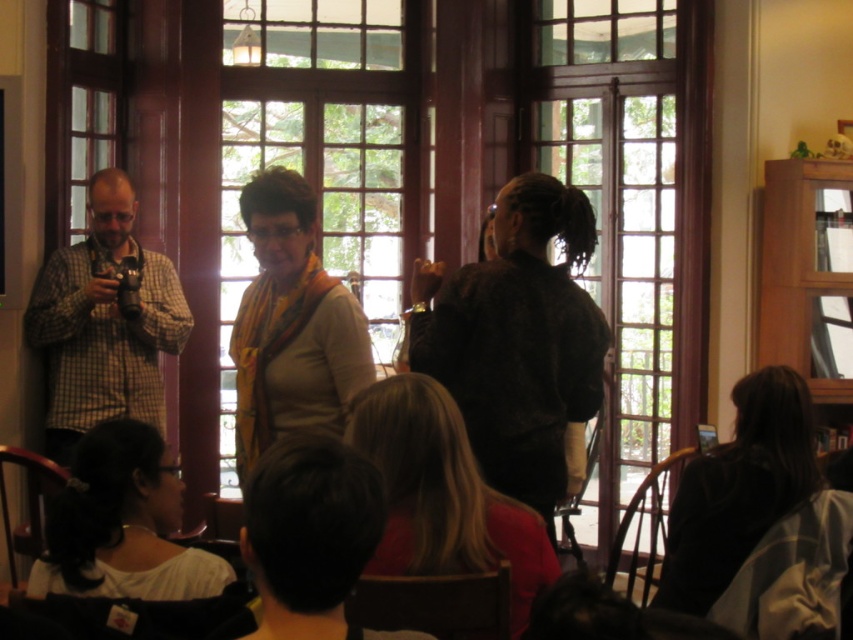
Question: Does matte yellow scarf at center have a greater width compared to white fabric at lower left?

Choices:
 (A) yes
 (B) no

Answer: (A)

Question: Can you confirm if blonde hair at center is bigger than dark brown hair at lower right?

Choices:
 (A) yes
 (B) no

Answer: (B)

Question: Which is farther from the blonde hair at center?

Choices:
 (A) dark brown hair at lower right
 (B) checkered fabric shirt at left
 (C) white fabric at lower left
 (D) matte yellow scarf at center

Answer: (B)

Question: Among these objects, which one is farthest from the camera?

Choices:
 (A) white fabric at lower left
 (B) blonde hair at center

Answer: (B)

Question: Which point is closer to the camera taking this photo?

Choices:
 (A) 61,276
 (B) 432,406

Answer: (B)

Question: Can you confirm if matte yellow scarf at center is wider than white fabric at lower left?

Choices:
 (A) no
 (B) yes

Answer: (B)